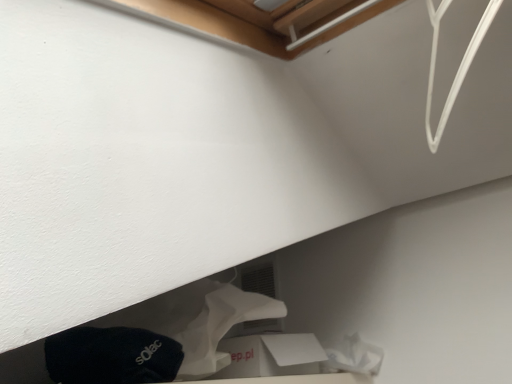
Question: Should I look upward or downward to see white plastic wire at upper right?

Choices:
 (A) down
 (B) up

Answer: (B)